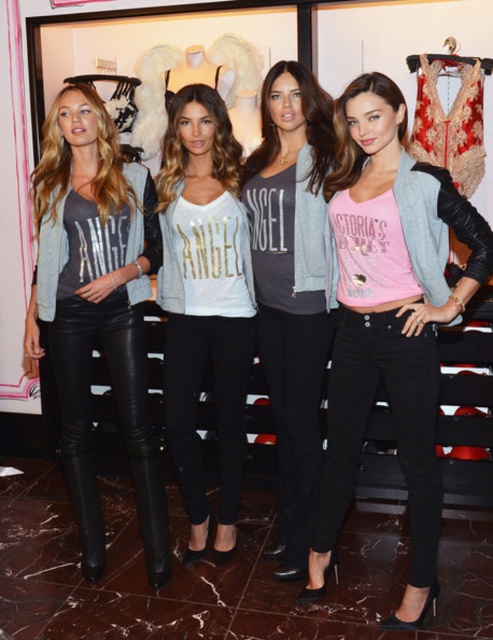
Question: Which point is closer to the camera?

Choices:
 (A) (90, 348)
 (B) (399, 192)

Answer: (B)

Question: Does matte black leather pants at left have a lesser width compared to white matte jersey at center?

Choices:
 (A) yes
 (B) no

Answer: (B)

Question: Which point is farther from the camera taking this photo?

Choices:
 (A) (89, 444)
 (B) (278, 364)
 (C) (410, 474)
 (D) (190, 266)

Answer: (A)

Question: Where is matte black leather pants at left located in relation to white matte jersey at center in the image?

Choices:
 (A) right
 (B) left

Answer: (B)

Question: Can you confirm if pink matte crop top at center is positioned below matte black leather pants at left?

Choices:
 (A) no
 (B) yes

Answer: (B)

Question: Which of the following is the closest to the observer?

Choices:
 (A) (319, 589)
 (B) (160, 550)
 (C) (174, 316)

Answer: (A)